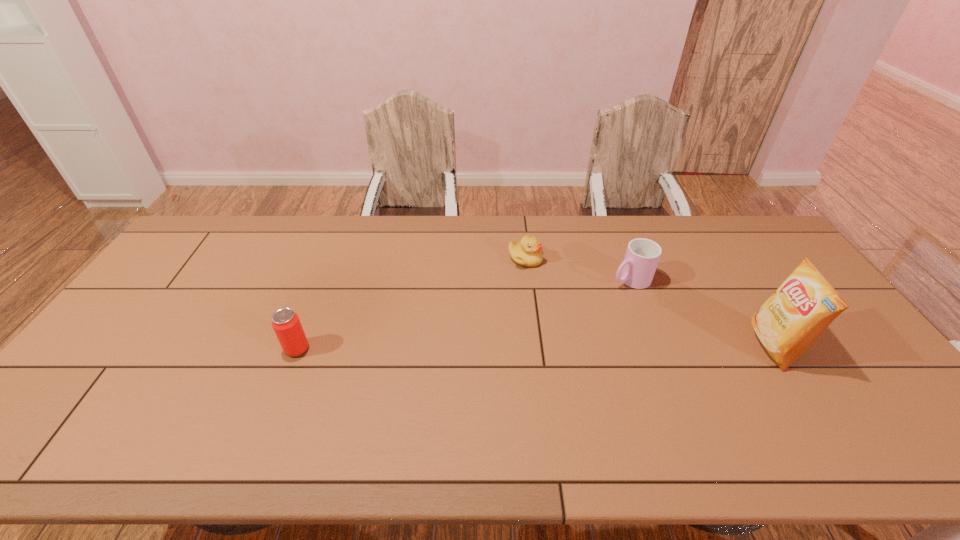
Where is `free space between the crisp (potato chip) and the shortest object`? The image size is (960, 540). free space between the crisp (potato chip) and the shortest object is located at coordinates (649, 302).

Locate an element on the screen. vacant space that's between the crisp (potato chip) and the second object from left to right is located at coordinates (649, 302).

Where is `free spot between the cup and the tallest object`? The height and width of the screenshot is (540, 960). free spot between the cup and the tallest object is located at coordinates (702, 313).

Where is `vacant space in between the shortest object and the rightmost object`? vacant space in between the shortest object and the rightmost object is located at coordinates (649, 302).

This screenshot has height=540, width=960. In order to click on free area in between the rightmost object and the duckling in this screenshot , I will do `click(649, 302)`.

Where is `unoccupied area between the cup and the shortest object`? This screenshot has height=540, width=960. unoccupied area between the cup and the shortest object is located at coordinates point(578,269).

Locate an element on the screen. The image size is (960, 540). vacant area between the third object from left to right and the duckling is located at coordinates (578, 269).

Identify the location of blank region between the tallest object and the duckling. (649, 302).

Image resolution: width=960 pixels, height=540 pixels. In order to click on free spot between the beer can and the rightmost object in this screenshot , I will do `click(535, 347)`.

Image resolution: width=960 pixels, height=540 pixels. In order to click on vacant space in between the duckling and the cup in this screenshot , I will do `click(578, 269)`.